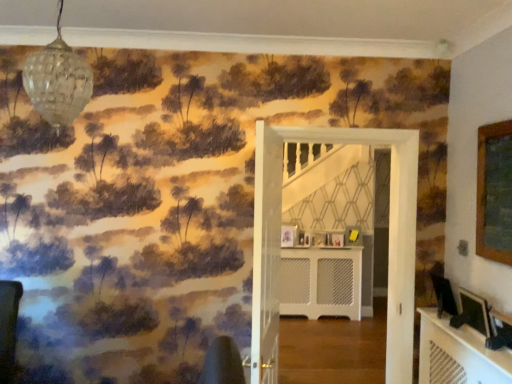
The image size is (512, 384). What do you see at coordinates (353, 236) in the screenshot?
I see `yellow matte picture frame at center, the 1th picture frame viewed from the back` at bounding box center [353, 236].

How much space does yellow matte picture frame at center, the first picture frame viewed from the right, occupy vertically?

yellow matte picture frame at center, the first picture frame viewed from the right, is 10.49 inches tall.

Measure the distance between wooden picture frame at center, the second picture frame viewed from the back, and camera.

A distance of 15.28 feet exists between wooden picture frame at center, the second picture frame viewed from the back, and camera.

Image resolution: width=512 pixels, height=384 pixels. What do you see at coordinates (279, 241) in the screenshot? I see `white wooden door at center, placed as the first door when sorted from right to left` at bounding box center [279, 241].

In order to face white wooden door at center, placed as the first door when sorted from right to left, should I rotate leftwards or rightwards?

Turn right approximately 11.423 degrees to face it.

Measure the distance between matte black picture frame at center, which ranks as the first picture frame in left-to-right order, and camera.

matte black picture frame at center, which ranks as the first picture frame in left-to-right order, is 15.17 feet away from camera.

Image resolution: width=512 pixels, height=384 pixels. Find the location of `white textured radiator at center`. white textured radiator at center is located at coordinates (321, 282).

From the picture: Is wooden picture frame at center, which is the 3th picture frame in front-to-back order, oriented towards white textured radiator at center?

No, wooden picture frame at center, which is the 3th picture frame in front-to-back order, is not oriented towards white textured radiator at center.

From a real-world perspective, who is located higher, wooden picture frame at center, the third picture frame in the back-to-front sequence, or white textured radiator at center?

From a 3D spatial view, wooden picture frame at center, the third picture frame in the back-to-front sequence, is above.

Locate an element on the screen. the 1st picture frame counting from the right side of the white textured radiator at center is located at coordinates (334, 239).

Could you measure the distance between wooden picture frame at center, which is the 3th picture frame in right-to-left order, and white textured radiator at center?

The distance of wooden picture frame at center, which is the 3th picture frame in right-to-left order, from white textured radiator at center is 51.61 centimeters.

Between point (328, 236) and point (468, 310), which one is positioned in front?

The point (468, 310) is closer.

Locate an element on the screen. the 2nd picture frame below the wooden picture frame at center, the third picture frame in the back-to-front sequence (from the image's perspective) is located at coordinates (472, 313).

What's the angular difference between wooden picture frame at center, which is the 3th picture frame in right-to-left order, and matte black picture frame at lower right, the second picture frame in the right-to-left sequence,'s facing directions?

52.5 degrees separate the facing orientations of wooden picture frame at center, which is the 3th picture frame in right-to-left order, and matte black picture frame at lower right, the second picture frame in the right-to-left sequence.

From their relative heights in the image, would you say wooden picture frame at center, placed as the 3th picture frame when sorted from left to right, is taller or shorter than matte black picture frame at lower right, the first picture frame positioned from the front?

In the image, wooden picture frame at center, placed as the 3th picture frame when sorted from left to right, appears to be shorter than matte black picture frame at lower right, the first picture frame positioned from the front.

Is white wooden door at center, the second door when ordered from front to back, to the left of wooden picture frame at center, placed as the fourth picture frame when sorted from front to back, from the viewer's perspective?

Correct, you'll find white wooden door at center, the second door when ordered from front to back, to the left of wooden picture frame at center, placed as the fourth picture frame when sorted from front to back.

Is white wooden door at center, the second door when ordered from front to back, positioned with its back to wooden picture frame at center, placed as the fourth picture frame when sorted from front to back?

Yes, white wooden door at center, the second door when ordered from front to back, is positioned with its back facing wooden picture frame at center, placed as the fourth picture frame when sorted from front to back.

From the image's perspective, is white wooden door at center, placed as the first door when sorted from right to left, beneath wooden picture frame at center, placed as the second picture frame when sorted from left to right?

Incorrect, from the image's perspective, white wooden door at center, placed as the first door when sorted from right to left, is higher than wooden picture frame at center, placed as the second picture frame when sorted from left to right.

What are the coordinates of `the 3rd picture frame behind the white wooden door at center, the first door positioned from the back, counting from the anchor's position` in the screenshot? It's located at (318, 239).

Is matte black picture frame at center, which ranks as the first picture frame in left-to-right order, placed right next to wooden picture frame at center, the third picture frame in the back-to-front sequence?

There is a gap between matte black picture frame at center, which ranks as the first picture frame in left-to-right order, and wooden picture frame at center, the third picture frame in the back-to-front sequence.

Does matte black picture frame at center, placed as the 2th picture frame when sorted from front to back, turn towards wooden picture frame at center, the third picture frame in the back-to-front sequence?

No, matte black picture frame at center, placed as the 2th picture frame when sorted from front to back, is not turned towards wooden picture frame at center, the third picture frame in the back-to-front sequence.

Looking at this image, considering the positions of objects matte black picture frame at center, the 5th picture frame in the right-to-left sequence, and wooden picture frame at center, the third picture frame in the back-to-front sequence, in the image provided, who is behind, matte black picture frame at center, the 5th picture frame in the right-to-left sequence, or wooden picture frame at center, the third picture frame in the back-to-front sequence,?

wooden picture frame at center, the third picture frame in the back-to-front sequence, is further from the camera.

From the image's perspective, is matte black picture frame at center, the 5th picture frame in the right-to-left sequence, located above or below wooden picture frame at center, placed as the 3th picture frame when sorted from left to right?

matte black picture frame at center, the 5th picture frame in the right-to-left sequence, is situated higher than wooden picture frame at center, placed as the 3th picture frame when sorted from left to right, in the image.

Is wooden picture frame at center, placed as the 3th picture frame when sorted from left to right, facing away from white wooden door at center, placed as the first door when sorted from right to left?

That's not correct — wooden picture frame at center, placed as the 3th picture frame when sorted from left to right, is not looking away from white wooden door at center, placed as the first door when sorted from right to left.

Is the position of wooden picture frame at center, which is the 3th picture frame in front-to-back order, more distant than that of white wooden door at center, placed as the first door when sorted from right to left?

Yes, it is behind white wooden door at center, placed as the first door when sorted from right to left.

Considering the sizes of objects wooden picture frame at center, which is the 3th picture frame in front-to-back order, and white wooden door at center, which ranks as the second door in left-to-right order, in the image provided, who is bigger, wooden picture frame at center, which is the 3th picture frame in front-to-back order, or white wooden door at center, which ranks as the second door in left-to-right order,?

Bigger between the two is white wooden door at center, which ranks as the second door in left-to-right order.

Is wooden picture frame at center, which is the 3th picture frame in right-to-left order, not inside white wooden door at center, placed as the first door when sorted from right to left?

Absolutely, wooden picture frame at center, which is the 3th picture frame in right-to-left order, is external to white wooden door at center, placed as the first door when sorted from right to left.

Would you say matte black picture frame at lower right, the second picture frame in the right-to-left sequence, is inside or outside white wooden door at center, the second door when ordered from front to back?

matte black picture frame at lower right, the second picture frame in the right-to-left sequence, is not inside white wooden door at center, the second door when ordered from front to back, it's outside.

Based on the photo, is matte black picture frame at lower right, the fifth picture frame viewed from the back, far away from white wooden door at center, the second door when ordered from front to back?

They are positioned close to each other.

Based on the photo, does matte black picture frame at lower right, the second picture frame in the right-to-left sequence, turn towards white wooden door at center, the first door positioned from the back?

No, matte black picture frame at lower right, the second picture frame in the right-to-left sequence, is not facing towards white wooden door at center, the first door positioned from the back.

Is matte black picture frame at center, the 5th picture frame in the right-to-left sequence, not near clear glass globe at upper left?

Yes, matte black picture frame at center, the 5th picture frame in the right-to-left sequence, is far from clear glass globe at upper left.

Considering the sizes of objects matte black picture frame at center, the fourth picture frame from the back, and clear glass globe at upper left in the image provided, who is smaller, matte black picture frame at center, the fourth picture frame from the back, or clear glass globe at upper left?

matte black picture frame at center, the fourth picture frame from the back.

Is matte black picture frame at center, which ranks as the first picture frame in left-to-right order, further to the viewer compared to clear glass globe at upper left?

Yes, it is behind clear glass globe at upper left.

From the white textured radiator at center, count 1st picture frame to the right and point to it. Please provide its 2D coordinates.

[(334, 239)]

The image size is (512, 384). There is a wooden picture frame at center, which is the 3th picture frame in front-to-back order. What are the coordinates of `the 2nd picture frame below it (from the image's perspective)` in the screenshot? It's located at (472, 313).

Considering their positions, is wooden picture frame at center, placed as the second picture frame when sorted from left to right, positioned further to yellow matte picture frame at center, the first picture frame viewed from the right, than white textured radiator at center?

white textured radiator at center is further to yellow matte picture frame at center, the first picture frame viewed from the right.

From the image, which object appears to be nearer to white wooden door at center, the first door positioned from the back, matte black picture frame at center, which ranks as the first picture frame in left-to-right order, or wooden picture frame at center, which appears as the fourth picture frame when viewed from the right?

matte black picture frame at center, which ranks as the first picture frame in left-to-right order, is closer to white wooden door at center, the first door positioned from the back.

When comparing their distances from white textured radiator at center, does wooden picture frame at center, the second picture frame viewed from the back, or wooden picture frame at center, placed as the 3th picture frame when sorted from left to right, seem further?

wooden picture frame at center, the second picture frame viewed from the back, is positioned further to the anchor white textured radiator at center.

From the image, which object appears to be nearer to white textured radiator at center, white wooden door at center, the second door when ordered from front to back, or clear glass globe at upper left?

white wooden door at center, the second door when ordered from front to back, is positioned closer to the anchor white textured radiator at center.

Based on their spatial positions, is matte black picture frame at lower right, which is the fourth picture frame in left-to-right order, or wooden picture frame at center, the third picture frame in the back-to-front sequence, closer to yellow matte picture frame at center, the first picture frame viewed from the right?

Based on the image, wooden picture frame at center, the third picture frame in the back-to-front sequence, appears to be nearer to yellow matte picture frame at center, the first picture frame viewed from the right.

From the image, which object appears to be farther from wooden picture frame at center, which is the 3th picture frame in right-to-left order, clear glass globe at upper left or wooden picture frame at center, placed as the second picture frame when sorted from left to right?

Among the two, clear glass globe at upper left is located further to wooden picture frame at center, which is the 3th picture frame in right-to-left order.

From the picture: When comparing their distances from white wooden door at center, placed as the first door when sorted from right to left, does white mesh door at center, placed as the second door when sorted from back to front, or yellow matte picture frame at center, the first picture frame viewed from the right, seem further?

yellow matte picture frame at center, the first picture frame viewed from the right, is positioned further to the anchor white wooden door at center, placed as the first door when sorted from right to left.

Which object lies further to the anchor point matte black picture frame at center, the fourth picture frame from the back, wooden picture frame at center, the second picture frame viewed from the back, or white textured radiator at center?

Among the two, white textured radiator at center is located further to matte black picture frame at center, the fourth picture frame from the back.

Image resolution: width=512 pixels, height=384 pixels. Identify the location of table between white wooden door at center, which ranks as the second door in left-to-right order, and wooden picture frame at center, which appears as the fourth picture frame when viewed from the right, along the z-axis. (321, 282).

Find the location of a particular element. table between clear glass globe at upper left and yellow matte picture frame at center, the first picture frame viewed from the right, from front to back is located at coordinates (321, 282).

Locate an element on the screen. This screenshot has height=384, width=512. table between matte black picture frame at lower right, the second picture frame in the right-to-left sequence, and wooden picture frame at center, which appears as the fourth picture frame when viewed from the right, along the z-axis is located at coordinates (321, 282).

The image size is (512, 384). In order to click on picture frame between matte black picture frame at center, the fourth picture frame from the back, and wooden picture frame at center, which is the 3th picture frame in right-to-left order in this screenshot , I will do `click(318, 239)`.